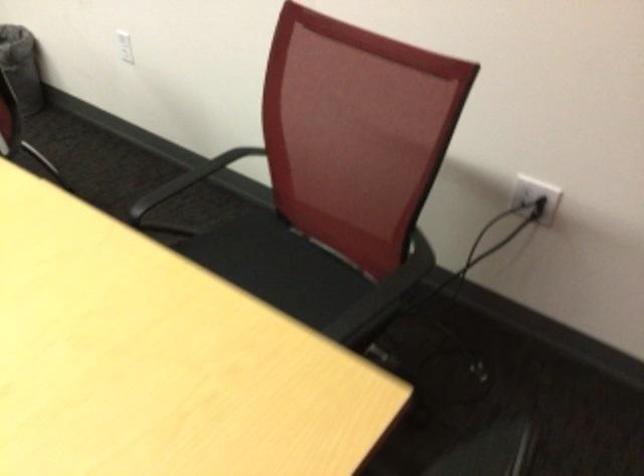
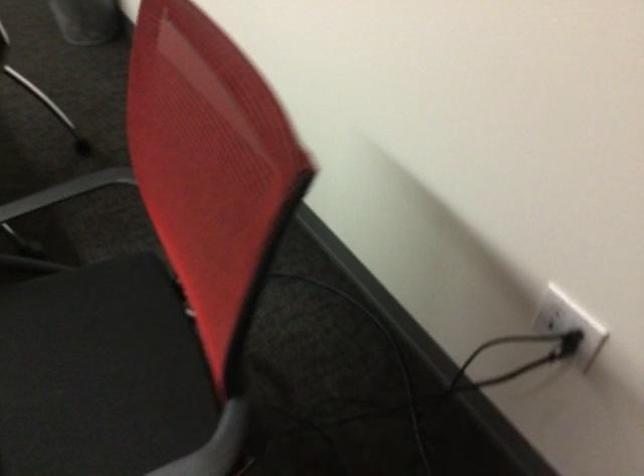
Find the pixel in the second image that matches the point at 274,283 in the first image.

(93, 372)